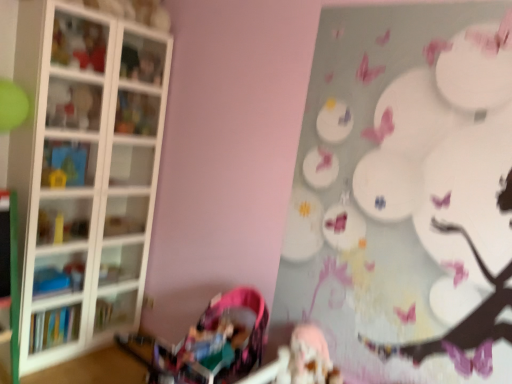
The height and width of the screenshot is (384, 512). Describe the element at coordinates (84, 185) in the screenshot. I see `white glass shelves at left, acting as the second shelf starting from the bottom` at that location.

The image size is (512, 384). What do you see at coordinates (68, 163) in the screenshot?
I see `blue plastic toy at left, the third shelf ordered from the bottom` at bounding box center [68, 163].

What is the approximate height of matte white cabinet at upper left?

matte white cabinet at upper left is 8.41 inches tall.

The height and width of the screenshot is (384, 512). Describe the element at coordinates (54, 327) in the screenshot. I see `hardcover book at left` at that location.

Measure the distance between hardcover book at left and camera.

The depth of hardcover book at left is 7.89 feet.

Describe the element at coordinates (58, 274) in the screenshot. I see `blue plastic shelf at left, which is the 1th shelf from bottom to top` at that location.

Image resolution: width=512 pixels, height=384 pixels. What do you see at coordinates (136, 113) in the screenshot? I see `translucent glass shelf at upper left, which appears as the 5th shelf when ordered from the bottom` at bounding box center [136, 113].

Locate an element on the screen. The height and width of the screenshot is (384, 512). white glass shelves at left, arranged as the fourth shelf when viewed from the top is located at coordinates (84, 185).

Is pink fabric baby carriage at lower left in contact with matte plastic toy at upper left?

No, pink fabric baby carriage at lower left is not beside matte plastic toy at upper left.

Is pink fabric baby carriage at lower left surrounding matte plastic toy at upper left?

No, matte plastic toy at upper left is not inside pink fabric baby carriage at lower left.

Considering their positions, is pink fabric baby carriage at lower left located in front of or behind matte plastic toy at upper left?

Clearly, pink fabric baby carriage at lower left is in front of matte plastic toy at upper left.

How different are the orientations of matte white cabinet at upper left and translucent glass shelf at upper left, which appears as the 5th shelf when ordered from the bottom, in degrees?

matte white cabinet at upper left and translucent glass shelf at upper left, which appears as the 5th shelf when ordered from the bottom, are facing 0.454 degrees away from each other.

Is matte white cabinet at upper left wider or thinner than translucent glass shelf at upper left, which appears as the 5th shelf when ordered from the bottom?

In the image, matte white cabinet at upper left appears to be wider than translucent glass shelf at upper left, which appears as the 5th shelf when ordered from the bottom.

Would you say matte white cabinet at upper left is to the left or to the right of translucent glass shelf at upper left, the 1th shelf when ordered from top to bottom, in the picture?

In the image, matte white cabinet at upper left appears on the right side of translucent glass shelf at upper left, the 1th shelf when ordered from top to bottom.

Does matte white cabinet at upper left have a smaller size compared to translucent glass shelf at upper left, which appears as the 5th shelf when ordered from the bottom?

Indeed, matte white cabinet at upper left has a smaller size compared to translucent glass shelf at upper left, which appears as the 5th shelf when ordered from the bottom.

Does pink fabric baby carriage at lower left touch white glass shelves at left, acting as the second shelf starting from the bottom?

No.

Is pink fabric baby carriage at lower left surrounding white glass shelves at left, arranged as the fourth shelf when viewed from the top?

No, white glass shelves at left, arranged as the fourth shelf when viewed from the top, is not inside pink fabric baby carriage at lower left.

From the image's perspective, is pink fabric baby carriage at lower left on top of white glass shelves at left, arranged as the fourth shelf when viewed from the top?

Incorrect, from the image's perspective, pink fabric baby carriage at lower left is lower than white glass shelves at left, arranged as the fourth shelf when viewed from the top.

Starting from the pink fabric baby carriage at lower left, which shelf is the 2nd one to the left? Please provide its 2D coordinates.

[(84, 185)]

From the image's perspective, would you say hardcover book at left is shown under blue plastic shelf at left, which is the 1th shelf from bottom to top?

Yes, from the image's perspective, hardcover book at left is beneath blue plastic shelf at left, which is the 1th shelf from bottom to top.

Is point (75, 316) closer to viewer compared to point (64, 263)?

Yes, point (75, 316) is closer to viewer.

The height and width of the screenshot is (384, 512). Identify the location of book below the blue plastic shelf at left, the fifth shelf from the top (from the image's perspective). (54, 327).

Between hardcover book at left and blue plastic shelf at left, which is the 1th shelf from bottom to top, which one has less height?

With less height is blue plastic shelf at left, which is the 1th shelf from bottom to top.

Who is taller, matte plastic toy at upper left or blue plastic shelf at left, which is the 1th shelf from bottom to top?

matte plastic toy at upper left.

Visually, is matte plastic toy at upper left positioned to the left or to the right of blue plastic shelf at left, which is the 1th shelf from bottom to top?

In the image, matte plastic toy at upper left appears on the right side of blue plastic shelf at left, which is the 1th shelf from bottom to top.

Is matte plastic toy at upper left touching blue plastic shelf at left, the fifth shelf from the top?

No.

From the image's perspective, is matte plastic toy at upper left above blue plastic shelf at left, which is the 1th shelf from bottom to top?

Yes, from the image's perspective, matte plastic toy at upper left is on top of blue plastic shelf at left, which is the 1th shelf from bottom to top.

Is the depth of matte plastic toy at upper left less than that of blue plastic toy at left, the third shelf ordered from the bottom?

Yes, matte plastic toy at upper left is in front of blue plastic toy at left, the third shelf ordered from the bottom.

Looking at their sizes, would you say matte plastic toy at upper left is wider or thinner than blue plastic toy at left, the third shelf from the top?

Clearly, matte plastic toy at upper left has more width compared to blue plastic toy at left, the third shelf from the top.

From the image's perspective, would you say matte plastic toy at upper left is shown under blue plastic toy at left, the third shelf ordered from the bottom?

No, from the image's perspective, matte plastic toy at upper left is not below blue plastic toy at left, the third shelf ordered from the bottom.

Measure the distance from matte plastic toy at upper left to blue plastic toy at left, the third shelf ordered from the bottom.

matte plastic toy at upper left is 22.44 inches away from blue plastic toy at left, the third shelf ordered from the bottom.

From the picture: From the image's perspective, is matte plastic shelf at upper left, which is the second shelf from top to bottom, below white glass shelves at left, acting as the second shelf starting from the bottom?

No, from the image's perspective, matte plastic shelf at upper left, which is the second shelf from top to bottom, is not beneath white glass shelves at left, acting as the second shelf starting from the bottom.

From a real-world perspective, is matte plastic shelf at upper left, the fourth shelf when ordered from bottom to top, beneath white glass shelves at left, acting as the second shelf starting from the bottom?

Actually, matte plastic shelf at upper left, the fourth shelf when ordered from bottom to top, is physically above white glass shelves at left, acting as the second shelf starting from the bottom, in the real world.

In the scene shown: Who is more distant, matte plastic shelf at upper left, which is the second shelf from top to bottom, or white glass shelves at left, arranged as the fourth shelf when viewed from the top?

matte plastic shelf at upper left, which is the second shelf from top to bottom, is behind.

Identify the location of the 3rd shelf located above the white glass shelves at left, arranged as the fourth shelf when viewed from the top (from a real-world perspective). This screenshot has width=512, height=384. (73, 105).

The width and height of the screenshot is (512, 384). In order to click on baby carriage below the matte plastic toy at upper left (from the image's perspective) in this screenshot , I will do `click(240, 323)`.

Where is `cabinet that is on the right side of translucent glass shelf at upper left, the 1th shelf when ordered from top to bottom`? cabinet that is on the right side of translucent glass shelf at upper left, the 1th shelf when ordered from top to bottom is located at coordinates (142, 59).

Considering their positions, is pink fabric baby carriage at lower left positioned closer to white glass shelves at left, arranged as the fourth shelf when viewed from the top, than blue plastic shelf at left, the fifth shelf from the top?

blue plastic shelf at left, the fifth shelf from the top.

In the scene shown: When comparing their distances from white glass shelves at left, acting as the second shelf starting from the bottom, does blue plastic toy at left, the third shelf from the top, or blue plastic shelf at left, which is the 1th shelf from bottom to top, seem further?

blue plastic shelf at left, which is the 1th shelf from bottom to top, is positioned further to the anchor white glass shelves at left, acting as the second shelf starting from the bottom.

From the image, which object appears to be farther from pink fabric baby carriage at lower left, matte white cabinet at upper left or matte plastic shelf at upper left, which is the second shelf from top to bottom?

Among the two, matte white cabinet at upper left is located further to pink fabric baby carriage at lower left.

When comparing their distances from white glass shelves at left, arranged as the fourth shelf when viewed from the top, does matte white cabinet at upper left or blue plastic toy at left, the third shelf ordered from the bottom, seem further?

The object further to white glass shelves at left, arranged as the fourth shelf when viewed from the top, is matte white cabinet at upper left.

When comparing their distances from matte plastic toy at upper left, does blue plastic toy at left, the third shelf ordered from the bottom, or hardcover book at left seem further?

Based on the image, hardcover book at left appears to be further to matte plastic toy at upper left.

Looking at the image, which one is located further to matte plastic shelf at upper left, the fourth shelf when ordered from bottom to top, translucent glass shelf at upper left, which appears as the 5th shelf when ordered from the bottom, or blue plastic shelf at left, which is the 1th shelf from bottom to top?

Based on the image, blue plastic shelf at left, which is the 1th shelf from bottom to top, appears to be further to matte plastic shelf at upper left, the fourth shelf when ordered from bottom to top.

Looking at the image, which one is located further to translucent glass shelf at upper left, the 1th shelf when ordered from top to bottom, matte plastic toy at upper left or white glass shelves at left, arranged as the fourth shelf when viewed from the top?

white glass shelves at left, arranged as the fourth shelf when viewed from the top, lies further to translucent glass shelf at upper left, the 1th shelf when ordered from top to bottom, than the other object.

Based on their spatial positions, is blue plastic toy at left, the third shelf ordered from the bottom, or pink fabric baby carriage at lower left further from matte plastic shelf at upper left, the fourth shelf when ordered from bottom to top?

pink fabric baby carriage at lower left is further to matte plastic shelf at upper left, the fourth shelf when ordered from bottom to top.

Identify the location of cabinet that lies between matte plastic toy at upper left and pink fabric baby carriage at lower left from top to bottom. The image size is (512, 384). (142, 59).

Find the location of a particular element. cabinet between matte plastic toy at upper left and blue plastic shelf at left, the fifth shelf from the top, from top to bottom is located at coordinates (142, 59).

The height and width of the screenshot is (384, 512). In order to click on toy between matte plastic shelf at upper left, the fourth shelf when ordered from bottom to top, and matte white cabinet at upper left from left to right in this screenshot , I will do `click(92, 47)`.

This screenshot has height=384, width=512. Find the location of `cabinet between matte plastic toy at upper left and translucent glass shelf at upper left, the 1th shelf when ordered from top to bottom, vertically`. cabinet between matte plastic toy at upper left and translucent glass shelf at upper left, the 1th shelf when ordered from top to bottom, vertically is located at coordinates click(x=142, y=59).